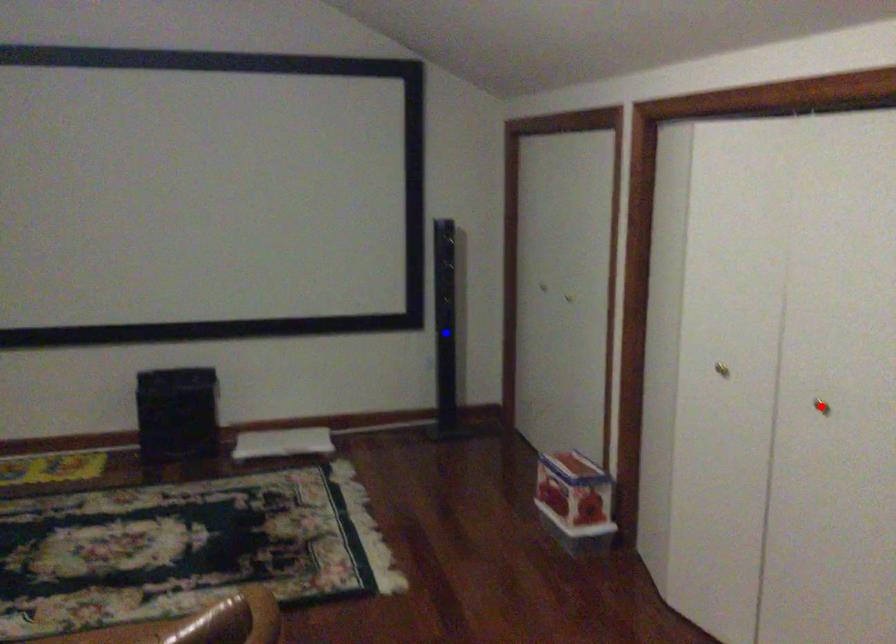
Question: Which of the two points in the image is closer to the camera?

Choices:
 (A) Blue point is closer.
 (B) Red point is closer.

Answer: (B)